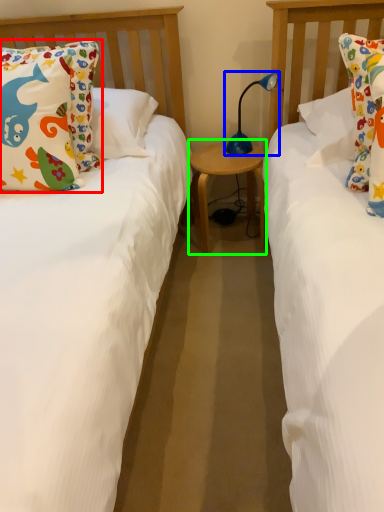
Question: Based on their relative distances, which object is nearer to pillow (highlighted by a red box)? Choose from table lamp (highlighted by a blue box) and table (highlighted by a green box).

Choices:
 (A) table lamp
 (B) table

Answer: (B)